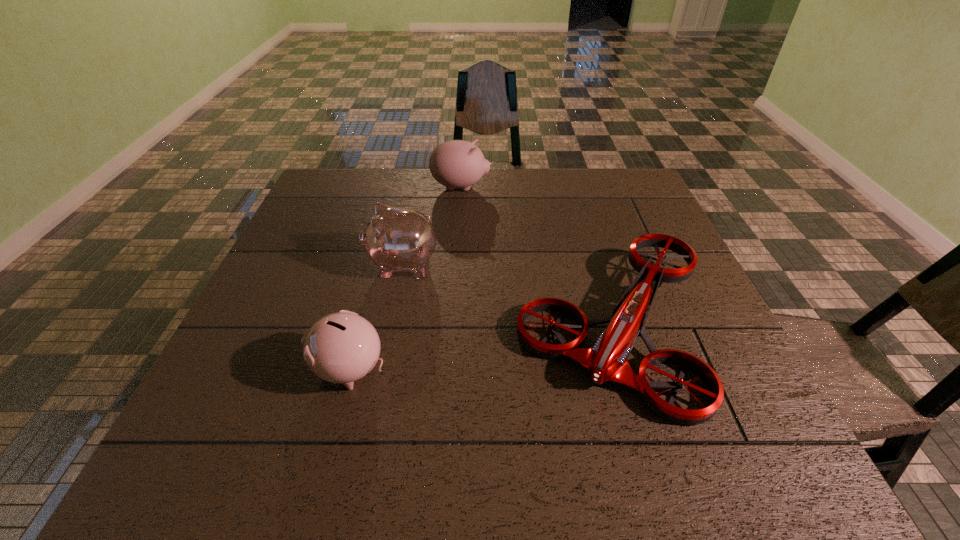
The height and width of the screenshot is (540, 960). Identify the location of free space in the image that satisfies the following two spatial constraints: 1. on the back side of the rightmost object; 2. on the front facing side of the second farthest piggy bank. (595, 265).

I want to click on blank area in the image that satisfies the following two spatial constraints: 1. on the front facing side of the second nearest piggy bank; 2. on the front side of the nearest piggy bank, so click(x=381, y=369).

Image resolution: width=960 pixels, height=540 pixels. Identify the location of free spot that satisfies the following two spatial constraints: 1. on the front facing side of the second nearest piggy bank; 2. on the right side of the drone. (389, 327).